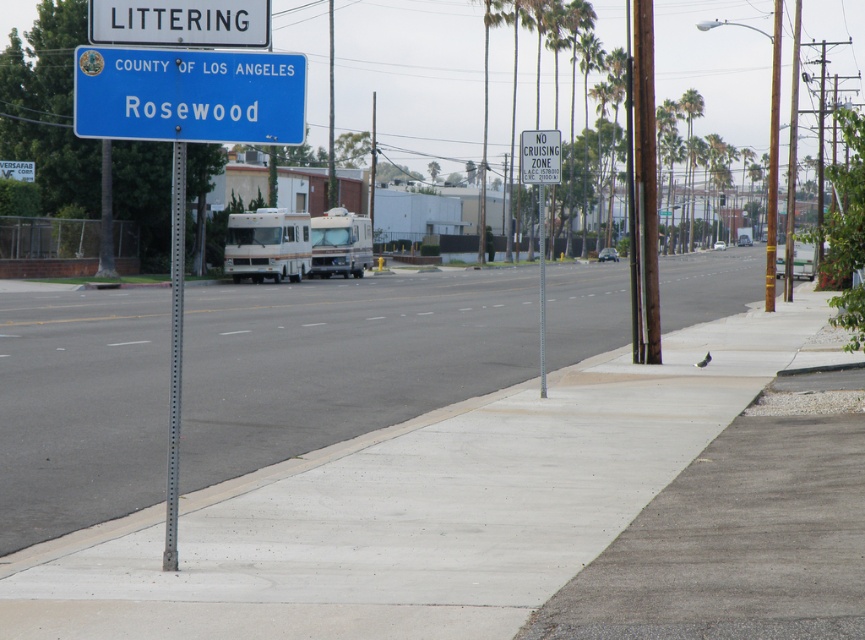
Question: Among these points, which one is nearest to the camera?

Choices:
 (A) (178, 112)
 (B) (196, 360)
 (C) (138, 36)
 (D) (552, 164)

Answer: (A)

Question: Among these points, which one is nearest to the camera?

Choices:
 (A) (322, 403)
 (B) (178, 436)

Answer: (B)

Question: Does white plastic littering sign at upper center appear over metallic pole at center?

Choices:
 (A) no
 (B) yes

Answer: (B)

Question: Can you confirm if gray concrete sidewalk at center is positioned below white plastic sign at upper center?

Choices:
 (A) yes
 (B) no

Answer: (A)

Question: Is blue metallic sign at upper center further to camera compared to white plastic littering sign at upper center?

Choices:
 (A) no
 (B) yes

Answer: (B)

Question: Which of the following is the closest to the observer?

Choices:
 (A) blue metallic sign at upper center
 (B) white plastic littering sign at upper center
 (C) white plastic sign at upper center

Answer: (B)